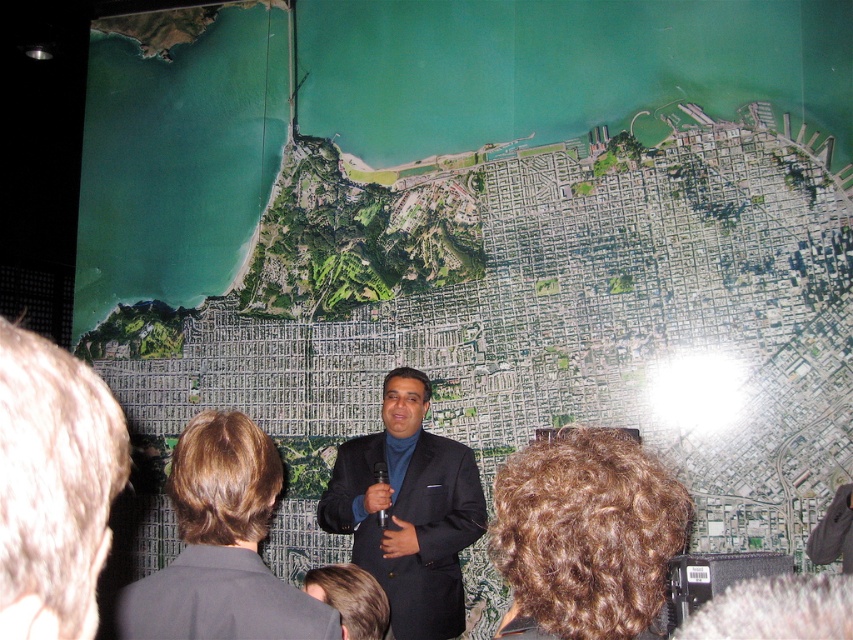
Where is the black suit at center located in the image?

The black suit at center is located at point 0.855 on the x axis and 0.260 on the y axis.